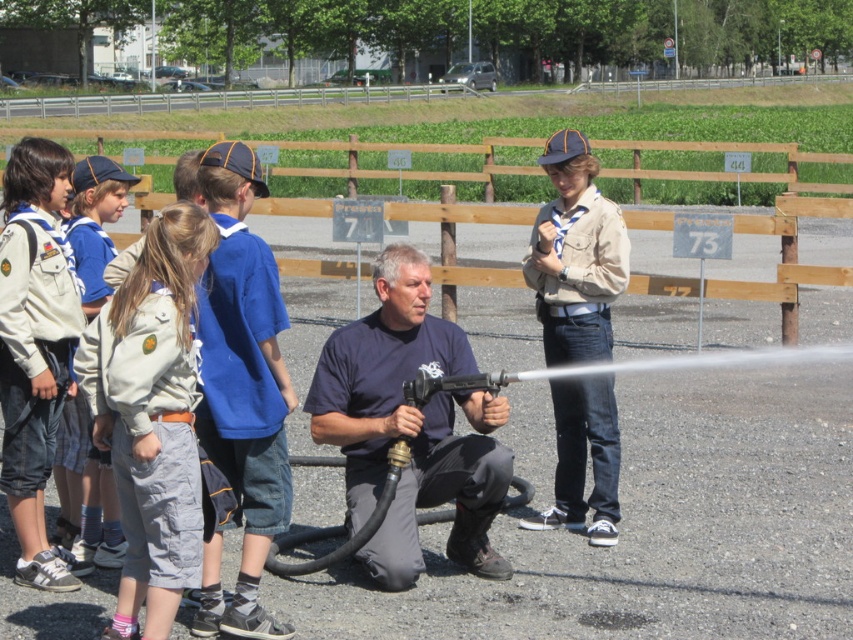
Based on the photo, is white cotton shirt at left further to camera compared to khaki uniform at left?

No, white cotton shirt at left is closer to the viewer.

What do you see at coordinates (35, 348) in the screenshot? I see `white cotton shirt at left` at bounding box center [35, 348].

Is point (24, 196) positioned behind point (102, 556)?

No.

The image size is (853, 640). In order to click on white cotton shirt at left in this screenshot , I will do pyautogui.click(x=35, y=348).

Between camouflage pants at left and white cotton shirt at left, which one is positioned higher?

white cotton shirt at left is above.

Which is more to the right, camouflage pants at left or white cotton shirt at left?

Positioned to the right is camouflage pants at left.

Who is more distant from viewer, (177, 442) or (51, 371)?

Point (51, 371)

Image resolution: width=853 pixels, height=640 pixels. What are the coordinates of `camouflage pants at left` in the screenshot? It's located at (151, 417).

Is white cotton shirt at left taller than wooden fence at center?

No, white cotton shirt at left is not taller than wooden fence at center.

Does white cotton shirt at left lie in front of wooden fence at center?

No, it is not.

Image resolution: width=853 pixels, height=640 pixels. What do you see at coordinates (35, 348) in the screenshot?
I see `white cotton shirt at left` at bounding box center [35, 348].

At what (x,y) coordinates should I click in order to perform the action: click on white cotton shirt at left. Please return your answer as a coordinate pair (x, y). This screenshot has height=640, width=853. Looking at the image, I should click on (35, 348).